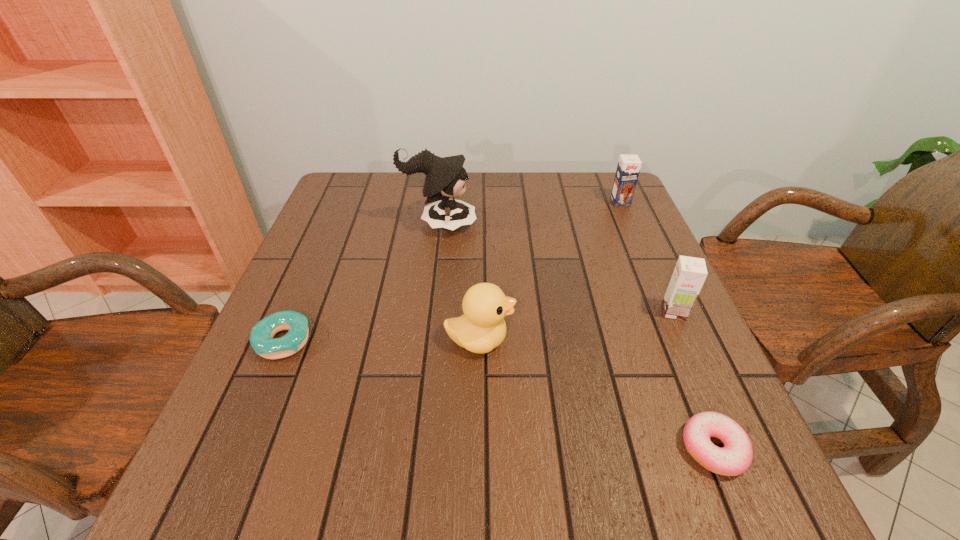
Locate an element on the screen. doll is located at coordinates (445, 179).

The width and height of the screenshot is (960, 540). Find the location of `the second farthest object`. the second farthest object is located at coordinates (445, 179).

Image resolution: width=960 pixels, height=540 pixels. Identify the location of the farther chocolate milk. (628, 168).

You are a GUI agent. You are given a task and a screenshot of the screen. Output one action in this format:
    pyautogui.click(x=<x>, y=<y>)
    Task: Click on the nearer chocolate milk
    
    Given the screenshot: What is the action you would take?
    pyautogui.click(x=689, y=275)

This screenshot has width=960, height=540. In order to click on duck in this screenshot , I will do `click(481, 328)`.

Where is `the farther doughnut`? This screenshot has height=540, width=960. the farther doughnut is located at coordinates (261, 339).

The width and height of the screenshot is (960, 540). Find the location of `the leftmost object`. the leftmost object is located at coordinates (261, 339).

Where is `the right doughnut`? the right doughnut is located at coordinates (736, 456).

Find the location of `the nearer doughnut`. the nearer doughnut is located at coordinates (736, 456).

The height and width of the screenshot is (540, 960). Identify the location of free space located 0.180m at the face of the second farthest object. (544, 224).